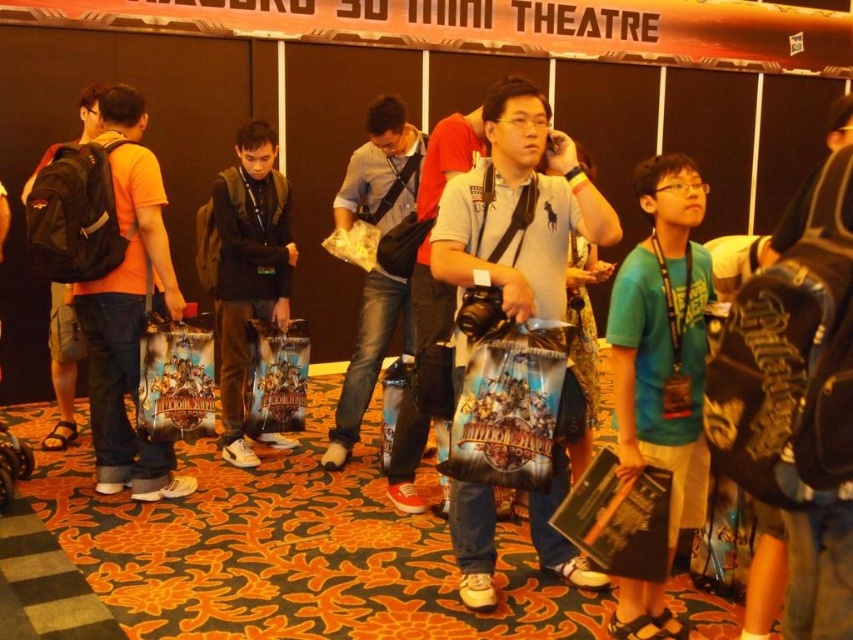
You are standing in the 3D Mini Theatre hall and want to take a photo of the point at coordinates point (683, 196). If your camera has a maximum focus range of 7 feet, will it be able to focus on that point?

The distance of point (683, 196) from camera is 7.39 feet. Since the camera can only focus up to 7 feet, it will not be able to focus on the point as it is beyond the maximum range.